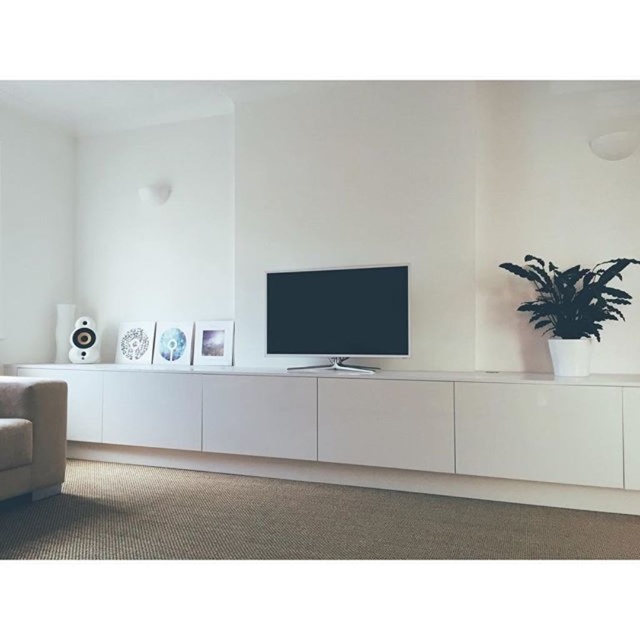
You are an interior designer planning to place a new rectangular shelf between the flat screen tv at center and the white glossy speaker at left. The shelf must fit horizontally between them. If the shelf is 0.5 meters wide, will it fit? Please explain your reasoning based on the objects provided.

The flat screen tv at center is wider than the white glossy speaker at left. Since the shelf needs to fit horizontally between them, the space between the TV and the speaker must be at least 0.5 meters. However, the description only states the TV is wider than the speaker, not the distance between them. Without knowing the exact spacing between the two objects, it is impossible to determine if the 0.5 meter shelf will fit.

You are a delivery person who needs to place a new speaker that is 0.3 meters wide between the flat screen tv at center and the white glossy speaker at left. Is there enough space between them to fit the new speaker?

The distance between the flat screen tv at center and the white glossy speaker at left is 1.86 meters. Since the new speaker is only 0.3 meters wide, there is sufficient space to place it between them.

You are arranging a new shelf in your living room and want to place the green leafy plant at right and the white glossy speaker at left. According to the scene, which object is positioned higher?

The green leafy plant at right is located above the white glossy speaker at left, so the plant is positioned higher.